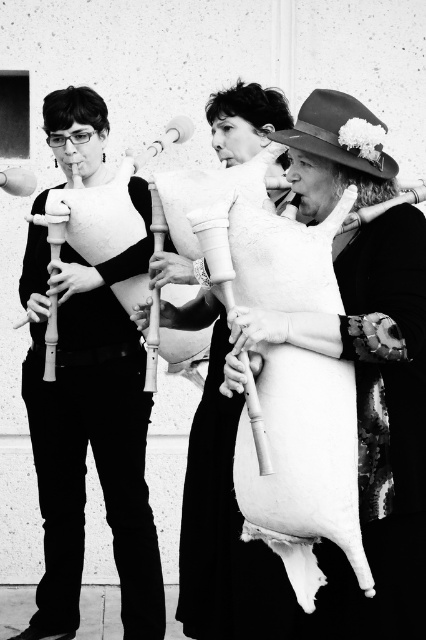
Where is the matte white flute at left located in the image?

The matte white flute at left is located at point (89, 435) in the image.

You are an instrument repair technician who needs to store the matte white flute at left and the white matte bagpipe at center in a narrow storage case. Based on their widths, which one might not fit if the case has limited space?

The matte white flute at left might be wider than the white matte bagpipe at center, so it might not fit in the narrow storage case.